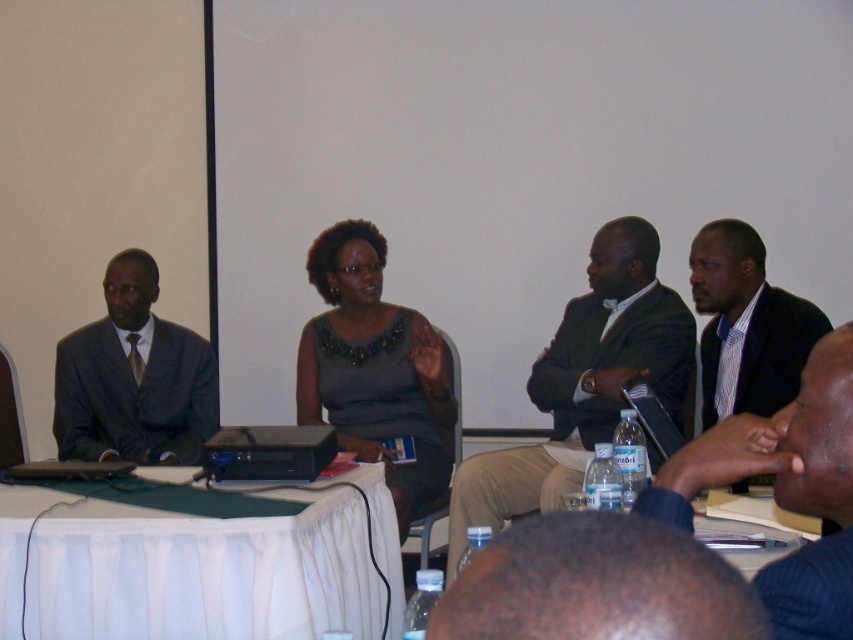
Question: Which point appears farthest from the camera in this image?

Choices:
 (A) (753, 404)
 (B) (102, 582)
 (C) (380, 280)
 (D) (843, 467)

Answer: (C)

Question: Is bald head at lower center below striped cotton shirt at right?

Choices:
 (A) yes
 (B) no

Answer: (A)

Question: Which is farther from the dark blue shirt at center?

Choices:
 (A) dark gray dress at center
 (B) bald head at lower center
 (C) dark green suit at center
 (D) striped cotton shirt at right

Answer: (A)

Question: Can you confirm if white fabric table at lower center is positioned above striped cotton shirt at right?

Choices:
 (A) no
 (B) yes

Answer: (A)

Question: Can you confirm if dark green suit at center is thinner than striped cotton shirt at right?

Choices:
 (A) yes
 (B) no

Answer: (B)

Question: Which point appears farthest from the camera in this image?

Choices:
 (A) (540, 592)
 (B) (154, 397)
 (C) (454, 552)

Answer: (B)